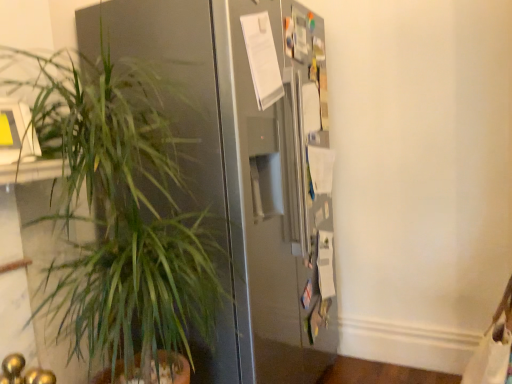
Question: Is satin silver refrigerator at center to the left of green leafy plant at left from the viewer's perspective?

Choices:
 (A) yes
 (B) no

Answer: (B)

Question: Can you confirm if satin silver refrigerator at center is shorter than green leafy plant at left?

Choices:
 (A) no
 (B) yes

Answer: (A)

Question: Is satin silver refrigerator at center positioned beyond the bounds of green leafy plant at left?

Choices:
 (A) yes
 (B) no

Answer: (A)

Question: Is satin silver refrigerator at center thinner than green leafy plant at left?

Choices:
 (A) yes
 (B) no

Answer: (B)

Question: Does satin silver refrigerator at center appear on the right side of green leafy plant at left?

Choices:
 (A) yes
 (B) no

Answer: (A)

Question: Considering the relative sizes of satin silver refrigerator at center and green leafy plant at left in the image provided, is satin silver refrigerator at center smaller than green leafy plant at left?

Choices:
 (A) no
 (B) yes

Answer: (A)

Question: Considering the relative sizes of green leafy plant at left and satin silver refrigerator at center in the image provided, is green leafy plant at left bigger than satin silver refrigerator at center?

Choices:
 (A) no
 (B) yes

Answer: (A)

Question: From the image's perspective, is green leafy plant at left on top of satin silver refrigerator at center?

Choices:
 (A) no
 (B) yes

Answer: (A)

Question: From the image's perspective, is green leafy plant at left beneath satin silver refrigerator at center?

Choices:
 (A) yes
 (B) no

Answer: (A)

Question: Is green leafy plant at left to the left of satin silver refrigerator at center from the viewer's perspective?

Choices:
 (A) yes
 (B) no

Answer: (A)

Question: Can you confirm if green leafy plant at left is wider than satin silver refrigerator at center?

Choices:
 (A) yes
 (B) no

Answer: (B)

Question: Considering the relative sizes of green leafy plant at left and satin silver refrigerator at center in the image provided, is green leafy plant at left smaller than satin silver refrigerator at center?

Choices:
 (A) no
 (B) yes

Answer: (B)

Question: In the image, is green leafy plant at left positioned in front of or behind satin silver refrigerator at center?

Choices:
 (A) behind
 (B) front

Answer: (B)